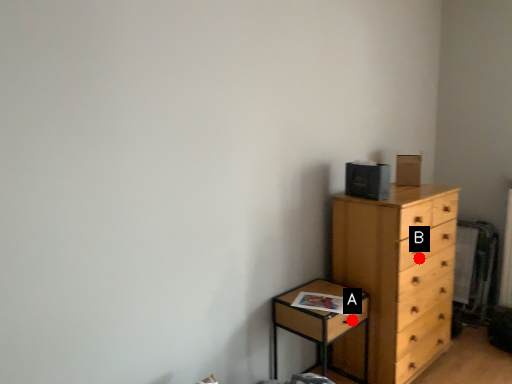
Question: Two points are circled on the image, labeled by A and B beside each circle. Which point is further to the camera?

Choices:
 (A) A is further
 (B) B is further

Answer: (B)